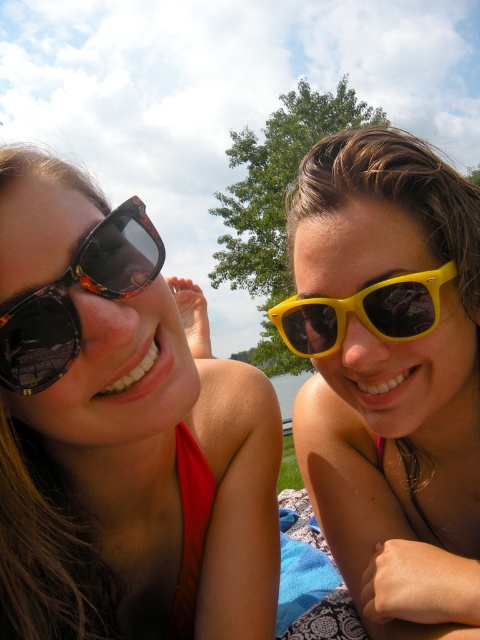
Between matte black sunglasses at left and yellow plastic sunglasses at right, which one is positioned higher?

yellow plastic sunglasses at right

The height and width of the screenshot is (640, 480). What do you see at coordinates (121, 433) in the screenshot? I see `matte black sunglasses at left` at bounding box center [121, 433].

You are a GUI agent. You are given a task and a screenshot of the screen. Output one action in this format:
    pyautogui.click(x=<x>, y=<y>)
    Task: Click on the matte black sunglasses at left
    This screenshot has height=640, width=480.
    Given the screenshot: What is the action you would take?
    [121, 433]

Can you confirm if matte black sunglasses at left is wider than blue fabric at lower right?

Correct, the width of matte black sunglasses at left exceeds that of blue fabric at lower right.

Looking at this image, is matte black sunglasses at left positioned in front of blue fabric at lower right?

Yes, it is.

Which is in front, point (44, 176) or point (314, 531)?

Point (44, 176)

Locate an element on the screen. The image size is (480, 640). matte black sunglasses at left is located at coordinates click(121, 433).

Between point (120, 428) and point (72, 356), which one is positioned in front?

Point (72, 356) is in front.

Image resolution: width=480 pixels, height=640 pixels. I want to click on matte black sunglasses at left, so click(121, 433).